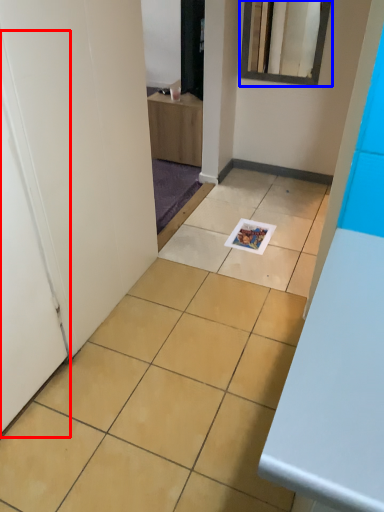
Question: Which object appears farthest to the camera in this image, door (highlighted by a red box) or mirror (highlighted by a blue box)?

Choices:
 (A) door
 (B) mirror

Answer: (B)